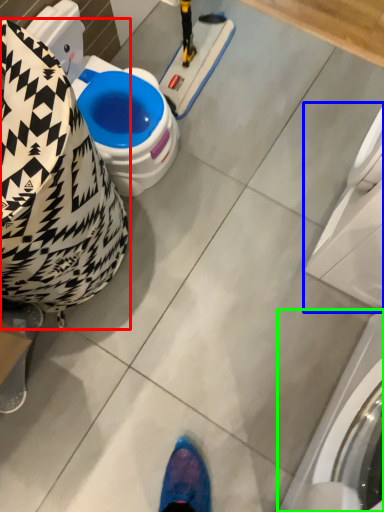
Question: Which is farther away from bean bag chair (highlighted by a red box)? washing machine (highlighted by a blue box) or washing machine (highlighted by a green box)?

Choices:
 (A) washing machine
 (B) washing machine

Answer: (B)